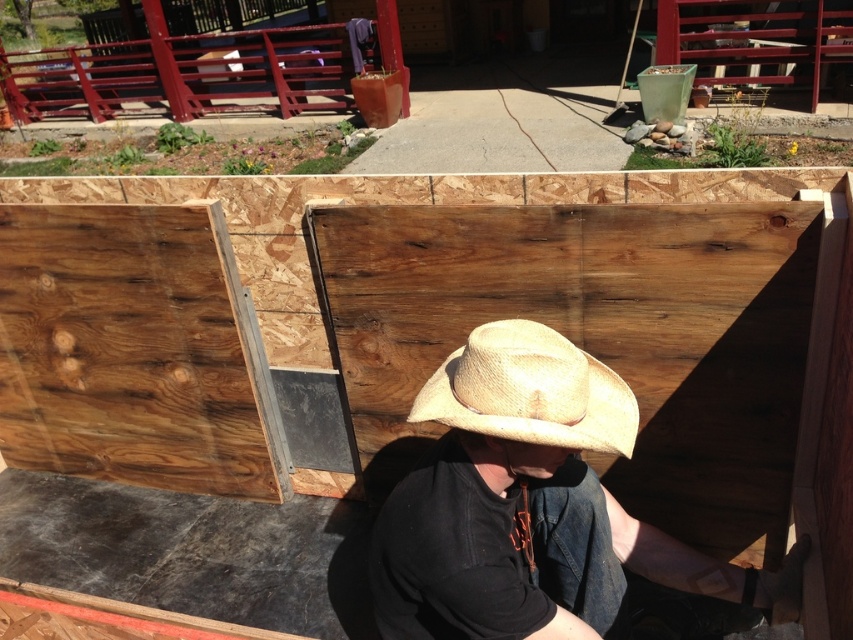
Question: Is the position of natural wood board at center less distant than that of strawmaterial/texture cowboy hat at center?

Choices:
 (A) yes
 (B) no

Answer: (B)

Question: Which object is closer to the camera taking this photo?

Choices:
 (A) strawmaterial/texture cowboy hat at center
 (B) natural wood board at center

Answer: (A)

Question: Is natural wood board at center bigger than strawmaterial/texture cowboy hat at center?

Choices:
 (A) no
 (B) yes

Answer: (B)

Question: Which is farther from the straw hat at center?

Choices:
 (A) strawmaterial/texture cowboy hat at center
 (B) natural wood board at center

Answer: (B)

Question: Based on their relative distances, which object is nearer to the natural wood board at center?

Choices:
 (A) strawmaterial/texture cowboy hat at center
 (B) straw hat at center

Answer: (B)

Question: Is straw hat at center to the left of strawmaterial/texture cowboy hat at center from the viewer's perspective?

Choices:
 (A) no
 (B) yes

Answer: (A)